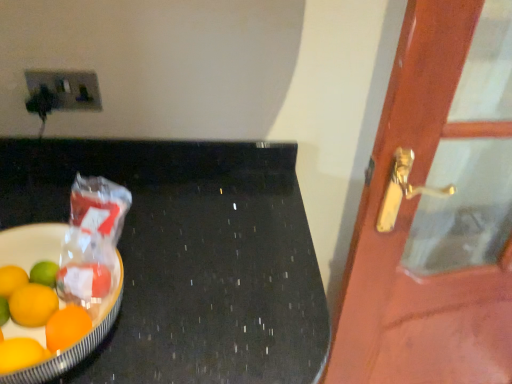
Question: Considering the relative sizes of matte plastic socket at upper left and black polished table at left in the image provided, is matte plastic socket at upper left wider than black polished table at left?

Choices:
 (A) no
 (B) yes

Answer: (A)

Question: Is matte plastic socket at upper left far from black polished table at left?

Choices:
 (A) no
 (B) yes

Answer: (A)

Question: Is black polished table at left surrounded by matte plastic socket at upper left?

Choices:
 (A) yes
 (B) no

Answer: (B)

Question: Is matte plastic socket at upper left to the left of black polished table at left from the viewer's perspective?

Choices:
 (A) no
 (B) yes

Answer: (B)

Question: Is matte plastic socket at upper left positioned with its back to black polished table at left?

Choices:
 (A) yes
 (B) no

Answer: (B)

Question: Does matte plastic socket at upper left have a lesser height compared to black polished table at left?

Choices:
 (A) yes
 (B) no

Answer: (A)

Question: From the image's perspective, is black polished table at left located above matte plastic socket at upper left?

Choices:
 (A) no
 (B) yes

Answer: (A)

Question: Can you confirm if black polished table at left is bigger than matte plastic socket at upper left?

Choices:
 (A) no
 (B) yes

Answer: (B)

Question: Is black polished table at left next to matte plastic socket at upper left?

Choices:
 (A) yes
 (B) no

Answer: (B)

Question: Considering the relative sizes of black polished table at left and matte plastic socket at upper left in the image provided, is black polished table at left wider than matte plastic socket at upper left?

Choices:
 (A) yes
 (B) no

Answer: (A)

Question: Would you say black polished table at left is outside matte plastic socket at upper left?

Choices:
 (A) yes
 (B) no

Answer: (A)

Question: Is black polished table at left positioned behind matte plastic socket at upper left?

Choices:
 (A) no
 (B) yes

Answer: (A)

Question: Does wooden door at right have a lesser height compared to black polished table at left?

Choices:
 (A) no
 (B) yes

Answer: (A)